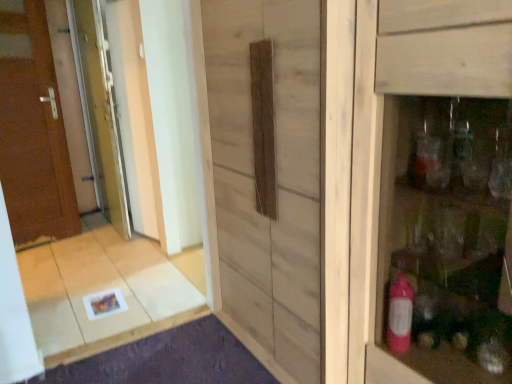
I want to click on vacant space in brown wooden door at left (from a real-world perspective), so click(x=51, y=237).